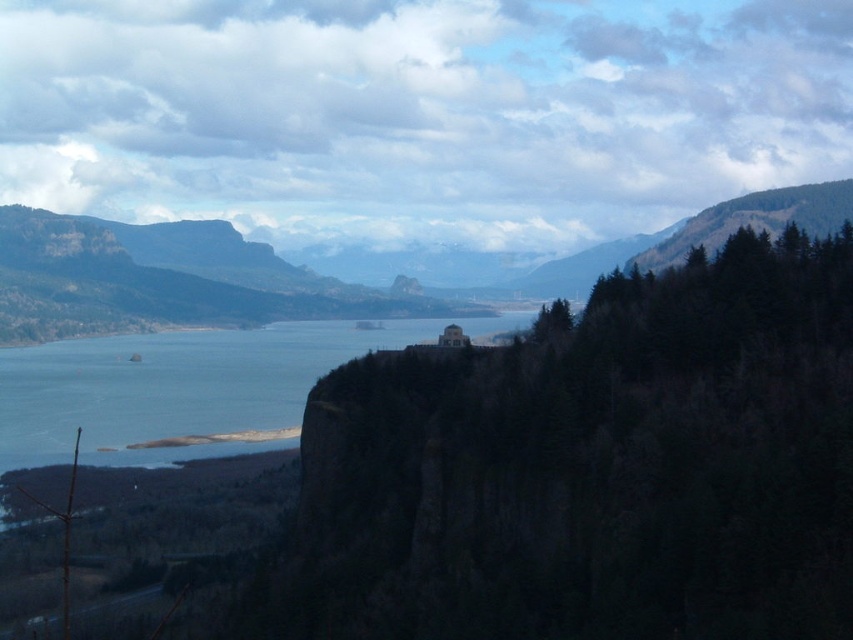
Question: Which point is closer to the camera?

Choices:
 (A) (172, 381)
 (B) (88, 324)

Answer: (A)

Question: Which point is farther to the camera?

Choices:
 (A) blue water at center
 (B) dark brown rocky cliff at center

Answer: (A)

Question: In this image, where is dark brown rocky cliff at center located relative to blue water at center?

Choices:
 (A) above
 (B) below

Answer: (A)

Question: Does dark brown rocky cliff at center have a lesser width compared to blue water at center?

Choices:
 (A) yes
 (B) no

Answer: (A)

Question: Which object is the farthest from the dark brown rocky cliff at center?

Choices:
 (A) green forested mountain at center
 (B) blue water at center

Answer: (B)

Question: Can you confirm if dark brown rocky cliff at center is positioned below blue water at center?

Choices:
 (A) yes
 (B) no

Answer: (B)